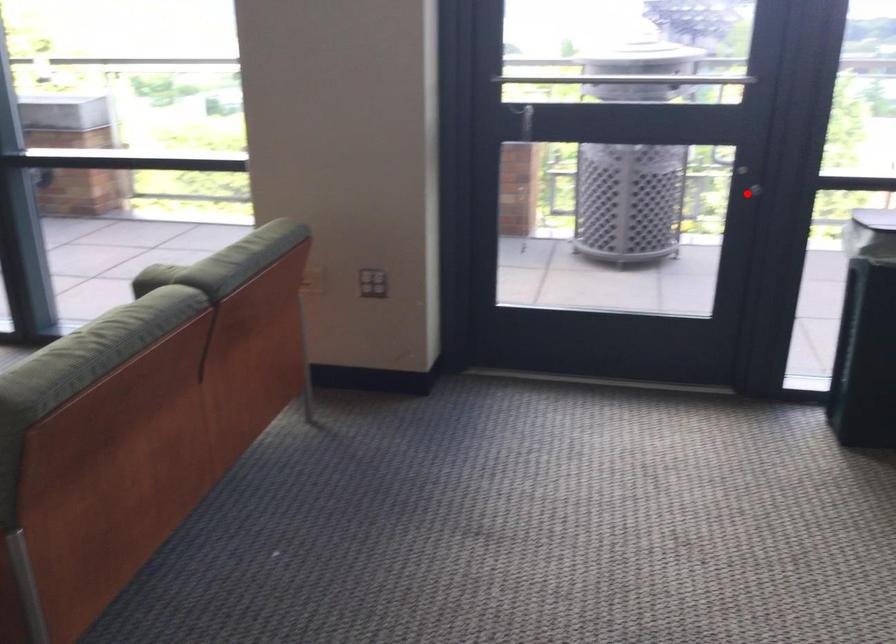
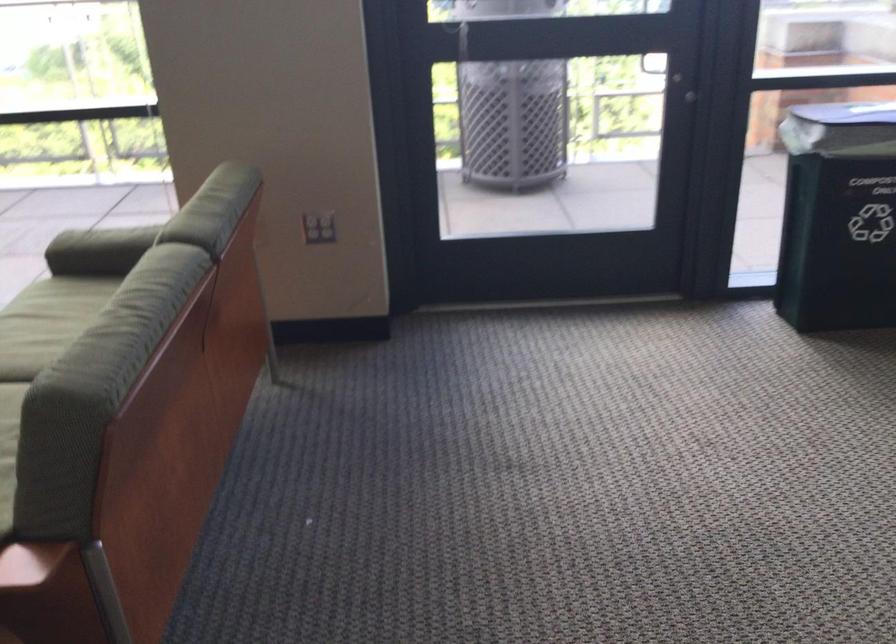
The point at the highlighted location is marked in the first image. Where is the corresponding point in the second image?

(691, 98)